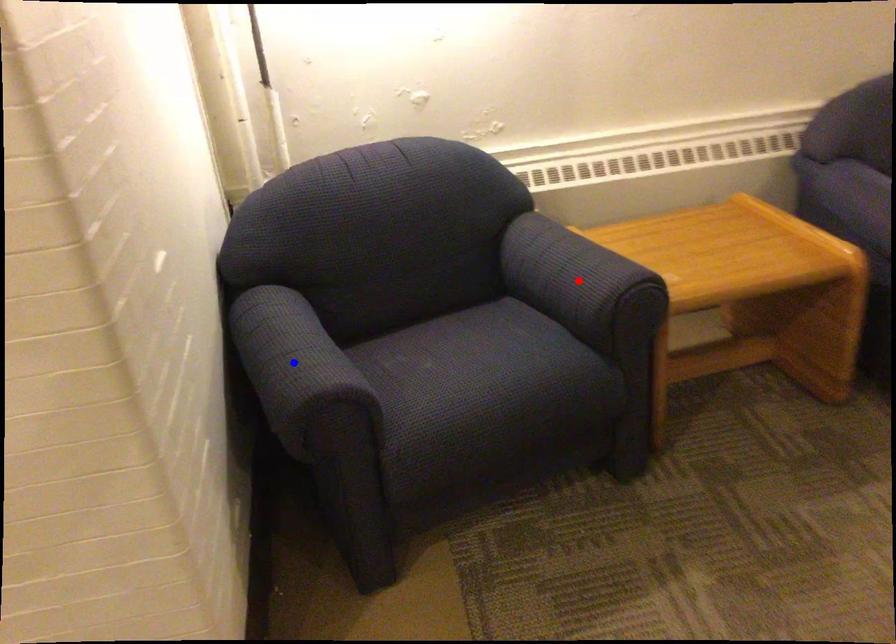
Question: Two points are marked on the image. Which point is closer to the camera?

Choices:
 (A) Blue point is closer.
 (B) Red point is closer.

Answer: (A)